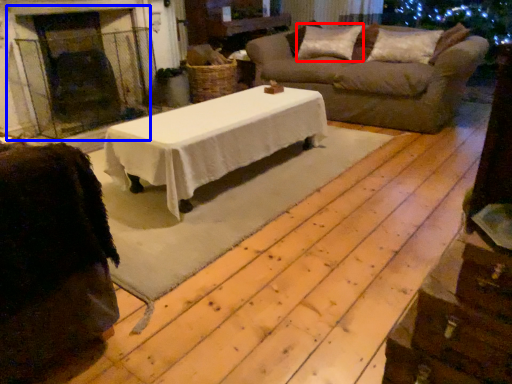
Question: Which object is further to the camera taking this photo, pillow (highlighted by a red box) or fireplace (highlighted by a blue box)?

Choices:
 (A) pillow
 (B) fireplace

Answer: (A)